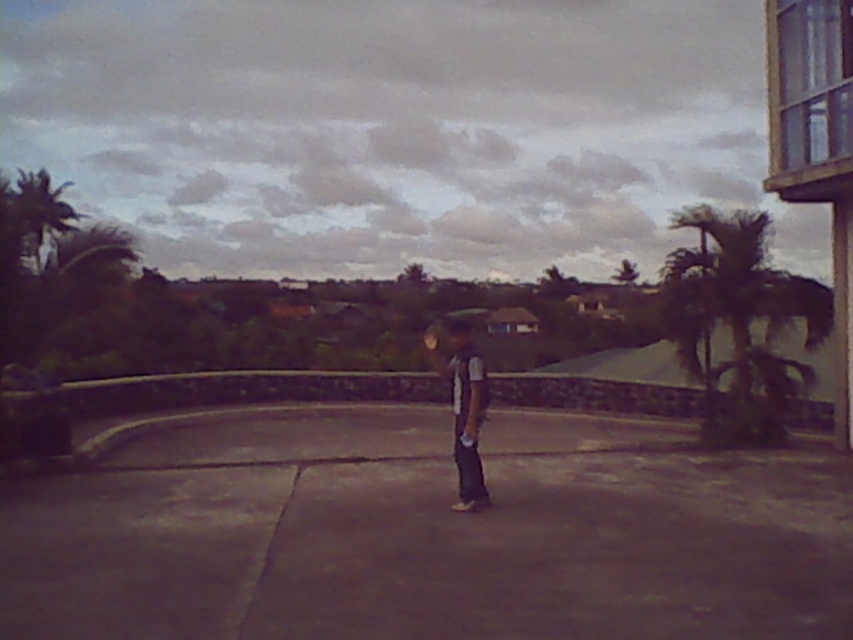
You are standing on the paved area and want to walk towards the green leafy palm tree at upper left. Which direction should you walk to avoid the green leafy palm tree at right?

To reach the green leafy palm tree at upper left while avoiding the green leafy palm tree at right, walk towards the upper left direction since the green leafy palm tree at right is located below it.

You are standing on the paved area and want to take a photo of both green leafy palm tree at right and green leafy palm tree at upper left. Which palm tree should you zoom in on to capture more details?

The green leafy palm tree at upper left is larger than the green leafy palm tree at right, so you should zoom in on the green leafy palm tree at upper left to capture more details.